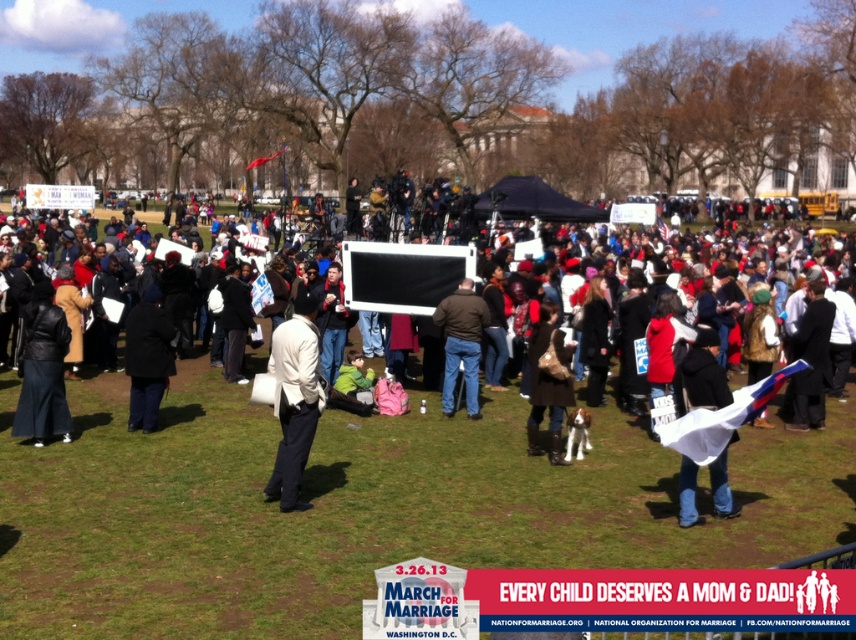
Question: Which object is positioned closest to the black fabric coat at center?

Choices:
 (A) white matte jacket at center
 (B) black leather jacket at lower left

Answer: (B)

Question: Considering the relative positions of white matte jacket at center and black fabric coat at center in the image provided, where is white matte jacket at center located with respect to black fabric coat at center?

Choices:
 (A) above
 (B) below

Answer: (B)

Question: Which of these objects is positioned farthest from the brown leather jacket at center?

Choices:
 (A) white paper at center
 (B) white matte sign at center
 (C) black fabric coat at center

Answer: (B)

Question: Does white matte jacket at center have a smaller size compared to black fabric coat at center?

Choices:
 (A) yes
 (B) no

Answer: (B)

Question: Which point is farther from the camera taking this photo?

Choices:
 (A) (681, 401)
 (B) (40, 340)
 (C) (479, 348)

Answer: (C)

Question: Is white matte jacket at center positioned before black fabric coat at center?

Choices:
 (A) yes
 (B) no

Answer: (A)